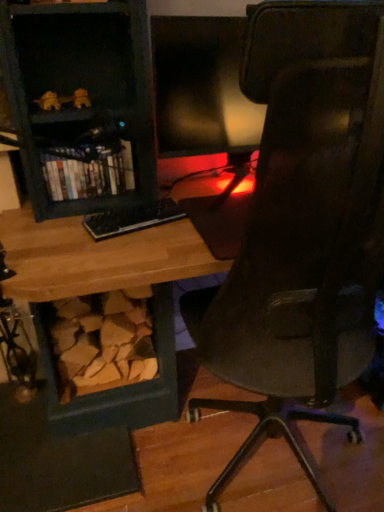
Where is `free location in front of black plastic keyboard at center`? The width and height of the screenshot is (384, 512). free location in front of black plastic keyboard at center is located at coordinates (126, 253).